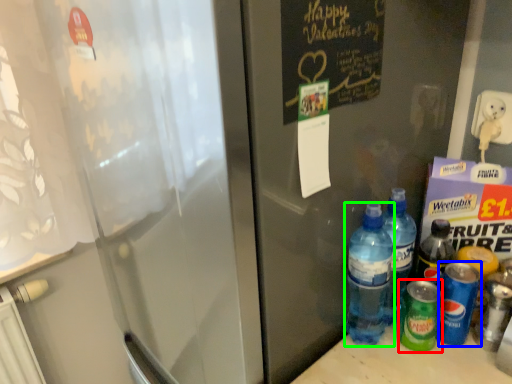
Question: Estimate the real-world distances between objects in this image. Which object is closer to bottle (highlighted by a red box), bottle (highlighted by a blue box) or bottle (highlighted by a green box)?

Choices:
 (A) bottle
 (B) bottle

Answer: (A)